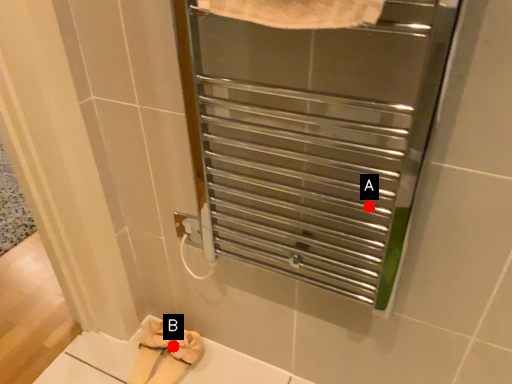
Question: Two points are circled on the image, labeled by A and B beside each circle. Which of the following is the farthest from the observer?

Choices:
 (A) A is further
 (B) B is further

Answer: (B)